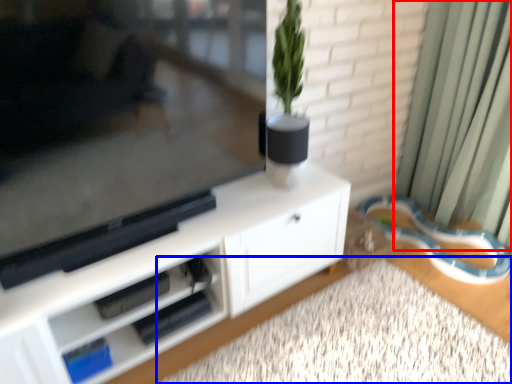
Question: Which object is further to the camera taking this photo, curtain (highlighted by a red box) or plain (highlighted by a blue box)?

Choices:
 (A) curtain
 (B) plain

Answer: (A)